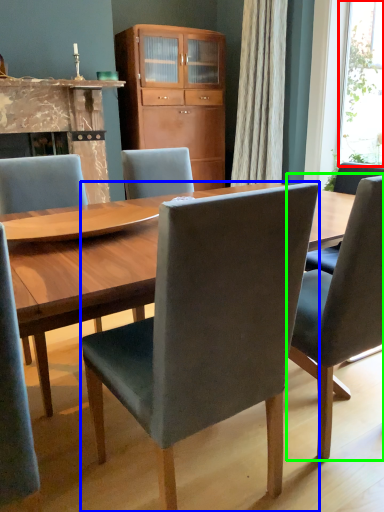
Question: Which is nearer to the window screen (highlighted by a red box)? chair (highlighted by a blue box) or chair (highlighted by a green box).

Choices:
 (A) chair
 (B) chair

Answer: (B)